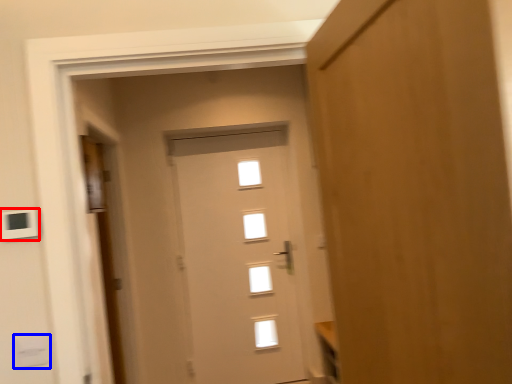
Question: Which object is closer to the camera taking this photo, light switch (highlighted by a red box) or light switch (highlighted by a blue box)?

Choices:
 (A) light switch
 (B) light switch

Answer: (A)